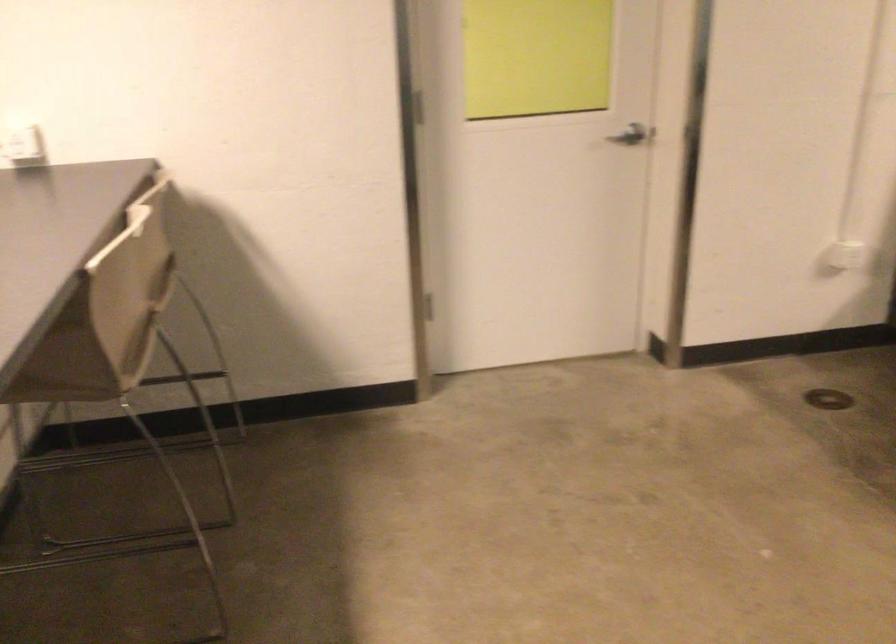
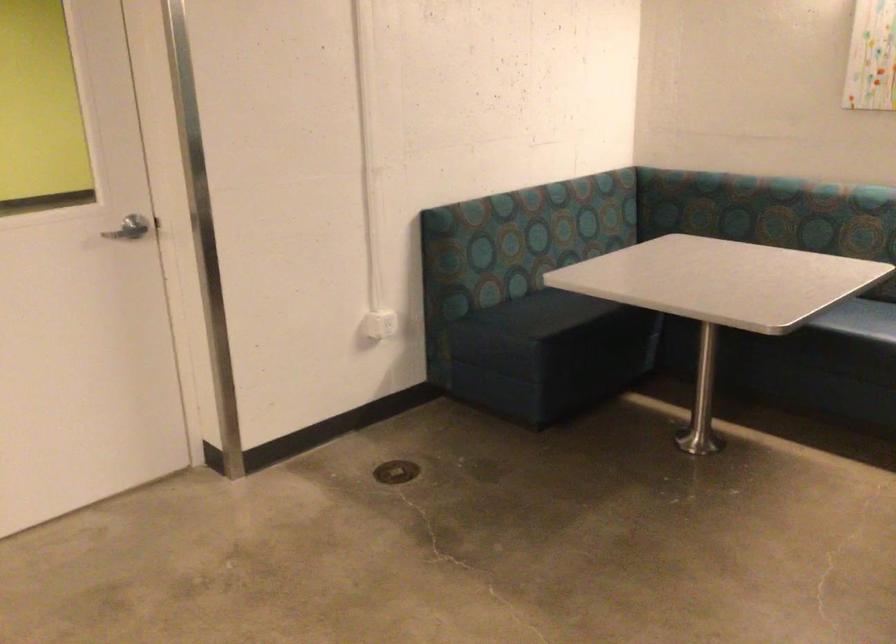
Question: Based on the continuous images, in which direction is the camera rotating? Reply with the corresponding letter.

Choices:
 (A) Left
 (B) Right
 (C) Up
 (D) Down

Answer: (B)